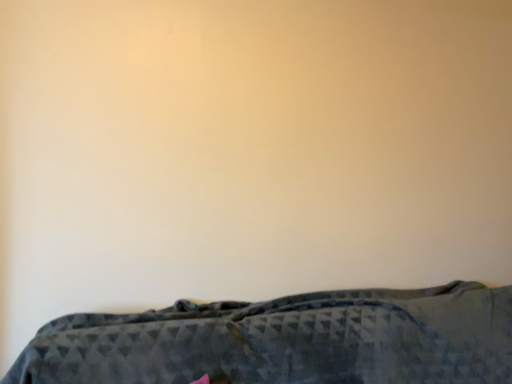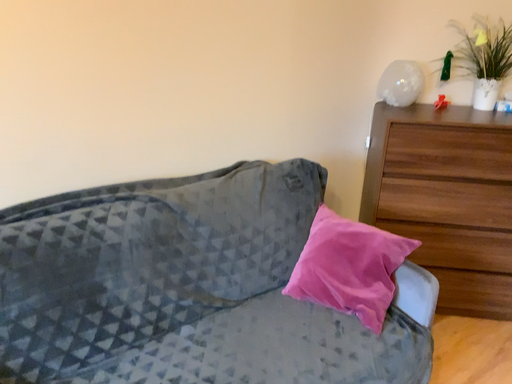
Question: Which way did the camera rotate in the video?

Choices:
 (A) rotated downward
 (B) rotated upward

Answer: (A)